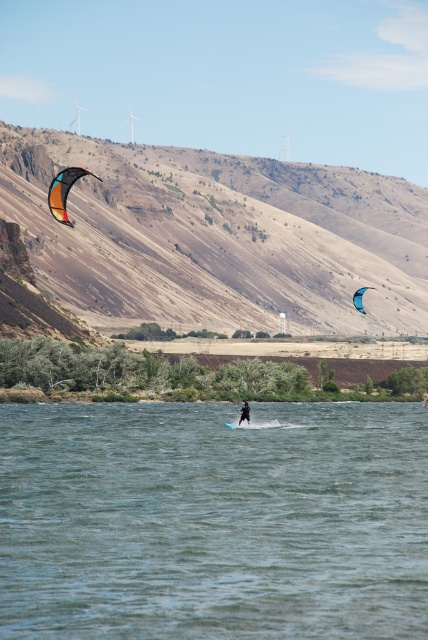
Is clear water at center behind black matte wetsuit at center?

No, clear water at center is in front of black matte wetsuit at center.

Which is more to the left, clear water at center or black matte wetsuit at center?

From the viewer's perspective, clear water at center appears more on the left side.

Is point (157, 628) behind point (247, 419)?

No, (157, 628) is closer to viewer.

The width and height of the screenshot is (428, 640). I want to click on clear water at center, so click(213, 522).

Between multicolored fabric kite at left and black matte wetsuit at center, which one is positioned higher?

multicolored fabric kite at left is above.

Which is below, multicolored fabric kite at left or black matte wetsuit at center?

black matte wetsuit at center

Describe the element at coordinates (64, 189) in the screenshot. I see `multicolored fabric kite at left` at that location.

Identify the location of multicolored fabric kite at left. This screenshot has height=640, width=428. (64, 189).

Based on the photo, is brown textured hillside at upper left below black matte wetsuit at center?

Actually, brown textured hillside at upper left is above black matte wetsuit at center.

Who is lower down, brown textured hillside at upper left or black matte wetsuit at center?

black matte wetsuit at center

The width and height of the screenshot is (428, 640). I want to click on brown textured hillside at upper left, so click(x=219, y=237).

Where is `brown textured hillside at upper left`? brown textured hillside at upper left is located at coordinates (219, 237).